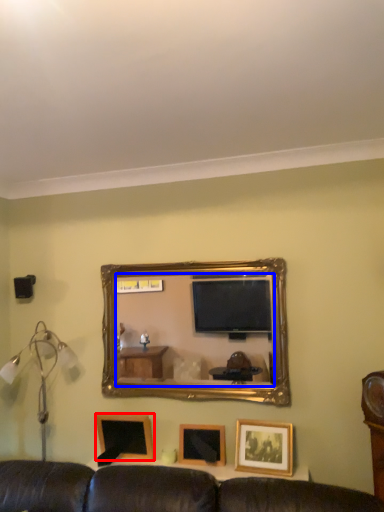
Question: Among these objects, which one is farthest to the camera, picture frame (highlighted by a red box) or mirror (highlighted by a blue box)?

Choices:
 (A) picture frame
 (B) mirror

Answer: (A)